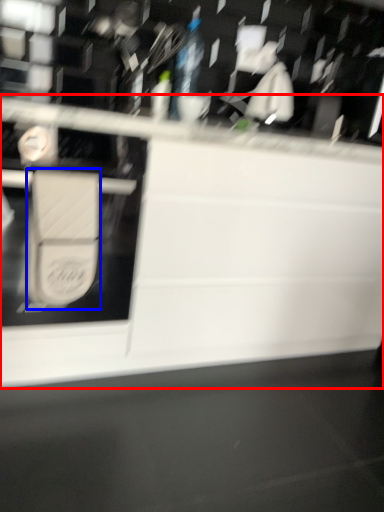
Question: Which object appears farthest to the camera in this image, countertop (highlighted by a red box) or wide (highlighted by a blue box)?

Choices:
 (A) countertop
 (B) wide

Answer: (B)